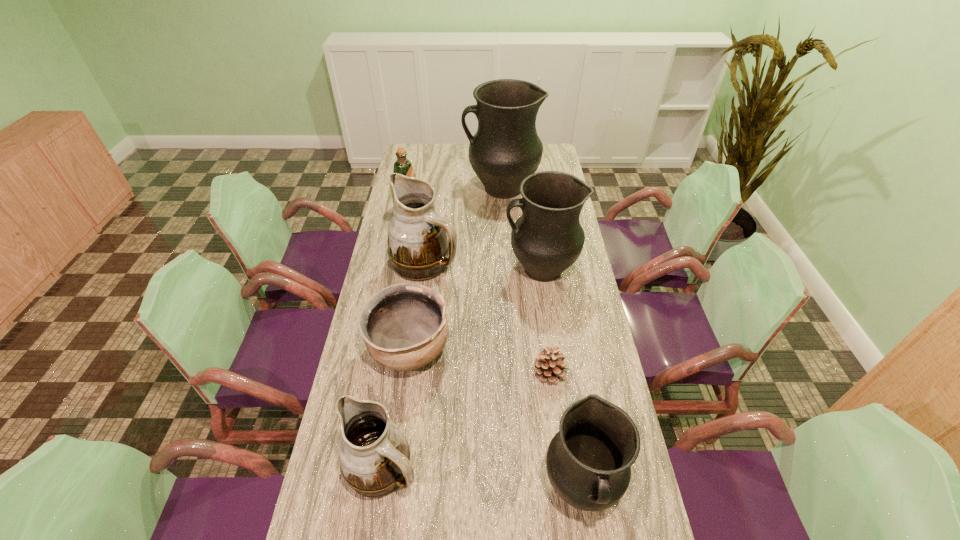
The height and width of the screenshot is (540, 960). In order to click on free space that satisfies the following two spatial constraints: 1. on the front-facing side of the green olive oil; 2. on the back side of the second shortest object in this screenshot , I will do `click(382, 350)`.

Locate an element on the screen. This screenshot has height=540, width=960. free region that satisfies the following two spatial constraints: 1. from the spout of the farther brown pitcher; 2. on the back side of the shortest object is located at coordinates [411, 373].

Identify the location of free spot that satisfies the following two spatial constraints: 1. on the front side of the seventh tallest object; 2. from the spout of the nearer brown pitcher. The image size is (960, 540). (394, 468).